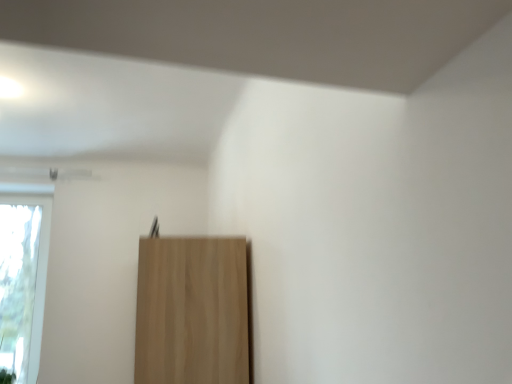
This screenshot has height=384, width=512. What do you see at coordinates (192, 311) in the screenshot?
I see `light wood cabinet at lower left` at bounding box center [192, 311].

Image resolution: width=512 pixels, height=384 pixels. In order to click on light wood cabinet at lower left in this screenshot , I will do `click(192, 311)`.

Find the location of `light wood cabinet at lower left`. light wood cabinet at lower left is located at coordinates (192, 311).